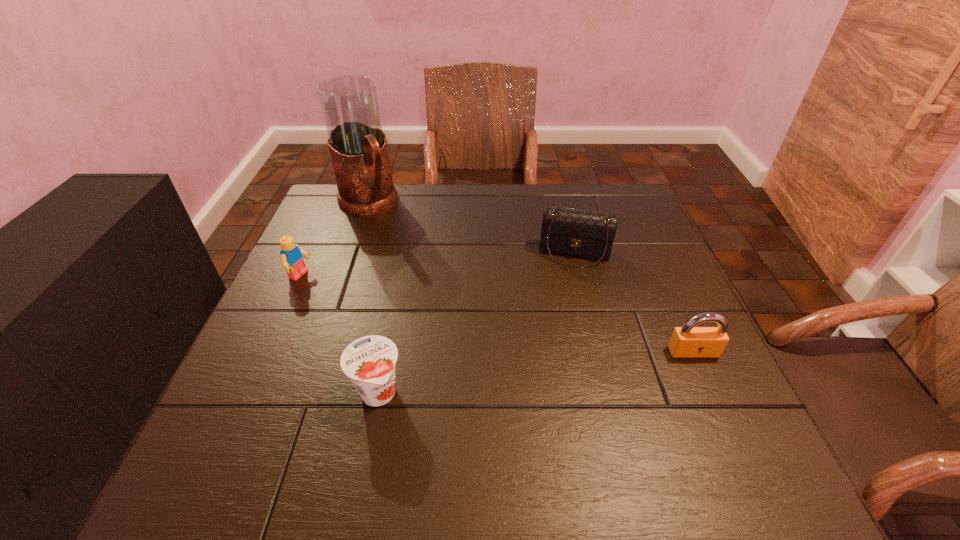
This screenshot has height=540, width=960. What are the coordinates of `empty space between the farthest object and the padlock` in the screenshot? It's located at (530, 277).

Find the location of a particular element. This screenshot has width=960, height=540. vacant space in between the clutch bag and the padlock is located at coordinates (634, 302).

At what (x,y) coordinates should I click in order to perform the action: click on the third closest object to the Lego. Please return your answer as a coordinate pair (x, y). This screenshot has height=540, width=960. Looking at the image, I should click on (581, 233).

Select which object is the fourth closest to the padlock. Please provide its 2D coordinates. Your answer should be formatted as a tuple, i.e. [(x, y)], where the tuple contains the x and y coordinates of a point satisfying the conditions above.

[(291, 259)]